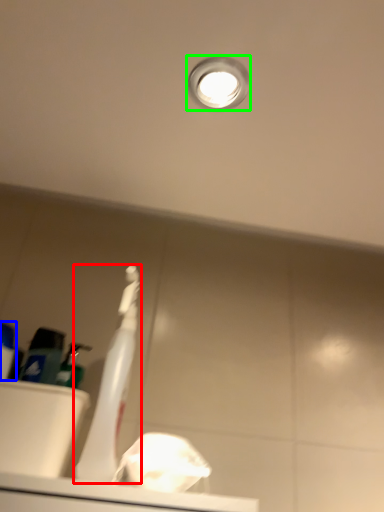
Question: Based on their relative distances, which object is farther from toothbrush (highlighted by a red box)? Choose from toiletry (highlighted by a blue box) and droplight (highlighted by a green box).

Choices:
 (A) toiletry
 (B) droplight

Answer: (B)